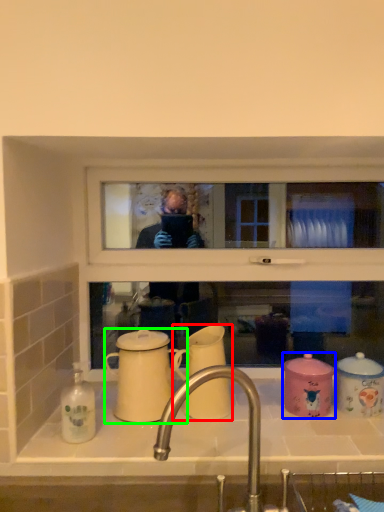
Question: Considering the real-world distances, which object is farthest from coffee cup (highlighted by a red box)? coffee cup (highlighted by a blue box) or coffee cup (highlighted by a green box)?

Choices:
 (A) coffee cup
 (B) coffee cup

Answer: (A)